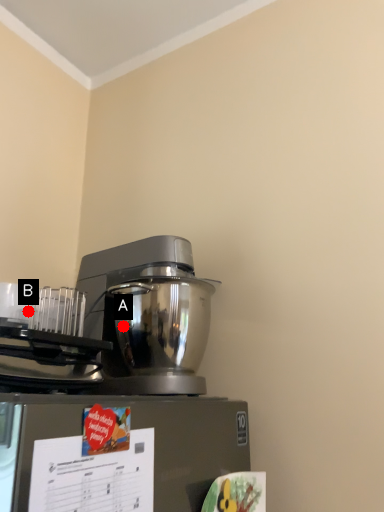
Question: Two points are circled on the image, labeled by A and B beside each circle. Which point is closer to the camera?

Choices:
 (A) A is closer
 (B) B is closer

Answer: (A)